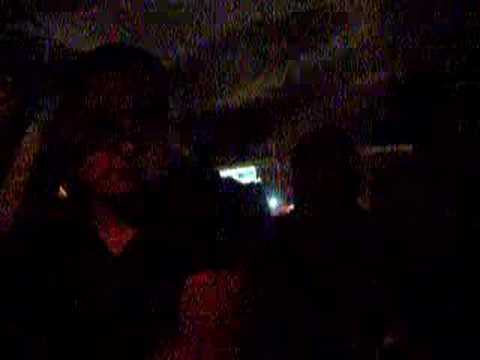
Locate an element on the screen. The height and width of the screenshot is (360, 480). light is located at coordinates (274, 203), (242, 175), (227, 173).